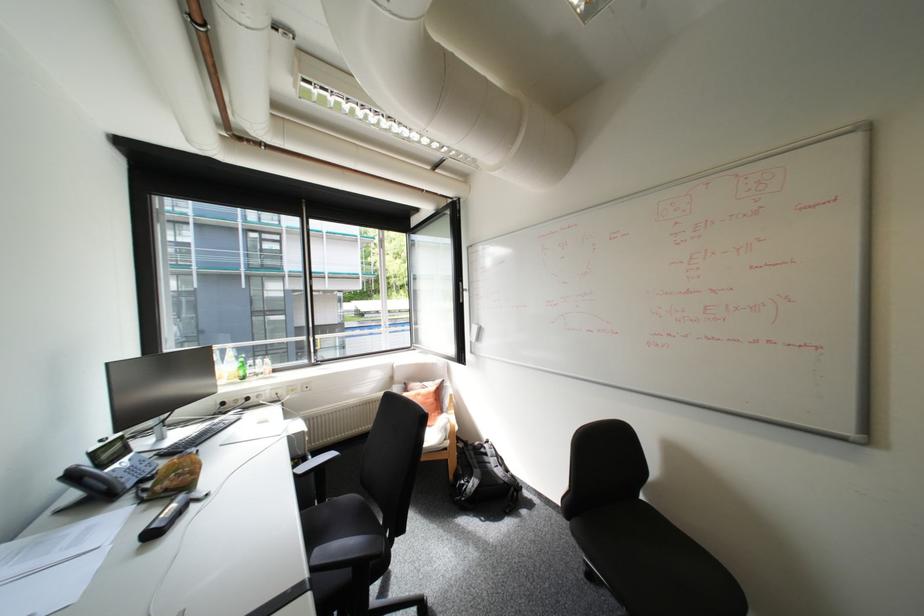
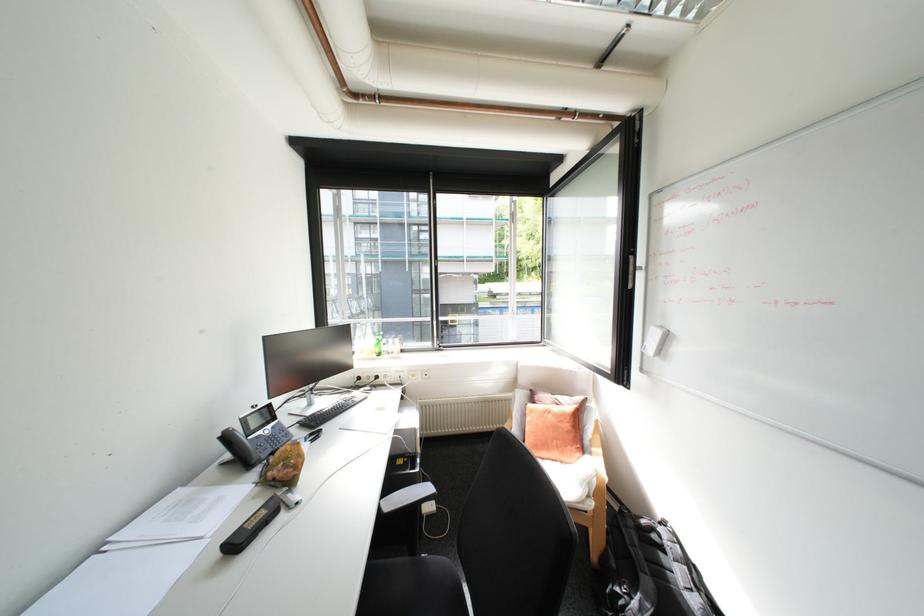
In the second image, find the point that corresponds to the point at 430,397 in the first image.

(561, 416)